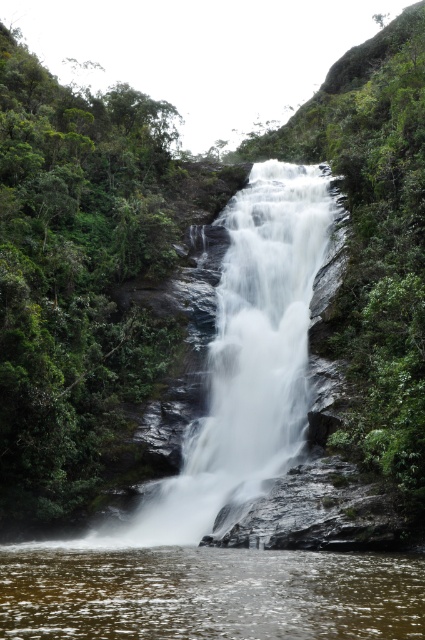
Can you confirm if green leafy foliage at left is smaller than clear water at center?

Actually, green leafy foliage at left might be larger than clear water at center.

The image size is (425, 640). Identify the location of green leafy foliage at left. (76, 275).

Locate an element on the screen. The image size is (425, 640). green leafy foliage at left is located at coordinates (76, 275).

Does white smooth waterfall at center have a lesser height compared to clear water at center?

Answer: In fact, white smooth waterfall at center may be taller than clear water at center.

Between white smooth waterfall at center and clear water at center, which one has more height?

Standing taller between the two is white smooth waterfall at center.

Based on the photo, measure the distance between point (263, 168) and camera.

A distance of 93.03 meters exists between point (263, 168) and camera.

Where is `white smooth waterfall at center`? white smooth waterfall at center is located at coordinates (246, 362).

Who is more distant from viewer, (19, 60) or (231, 285)?

The point (19, 60) is behind.

Is point (45, 262) positioned before point (292, 412)?

No, it is not.

Does point (23, 225) come behind point (231, 211)?

No.

At what (x,y) coordinates should I click in order to perform the action: click on green leafy foliage at left. Please return your answer as a coordinate pair (x, y). Looking at the image, I should click on (76, 275).